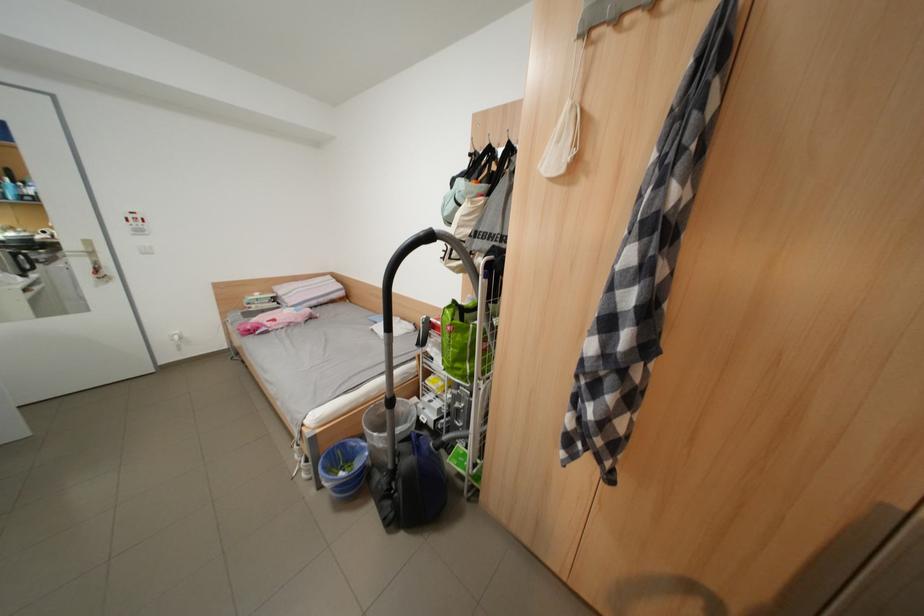
I want to click on green shopping bag, so click(464, 341).